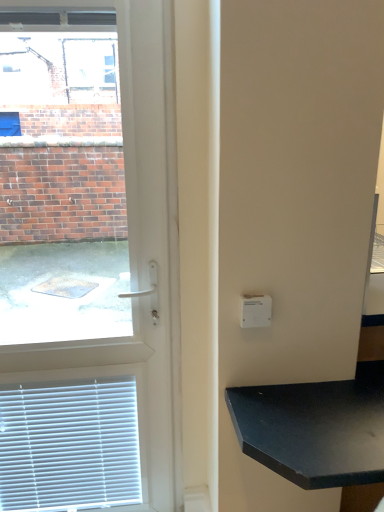
Question: From a real-world perspective, is white plastic door at left positioned under black matte table at lower right based on gravity?

Choices:
 (A) no
 (B) yes

Answer: (A)

Question: Is black matte table at lower right located within white plastic door at left?

Choices:
 (A) yes
 (B) no

Answer: (B)

Question: Does white plastic door at left have a greater width compared to black matte table at lower right?

Choices:
 (A) yes
 (B) no

Answer: (B)

Question: Does white plastic door at left appear on the right side of black matte table at lower right?

Choices:
 (A) no
 (B) yes

Answer: (A)

Question: Is white plastic door at left facing towards black matte table at lower right?

Choices:
 (A) no
 (B) yes

Answer: (A)

Question: From their relative heights in the image, would you say white plastic light switch at upper right is taller or shorter than white plastic door at left?

Choices:
 (A) short
 (B) tall

Answer: (A)

Question: From the image's perspective, is white plastic light switch at upper right above or below white plastic door at left?

Choices:
 (A) above
 (B) below

Answer: (A)

Question: From a real-world perspective, is white plastic light switch at upper right physically located above or below white plastic door at left?

Choices:
 (A) below
 (B) above

Answer: (B)

Question: Considering the positions of white plastic light switch at upper right and white plastic door at left in the image, is white plastic light switch at upper right bigger or smaller than white plastic door at left?

Choices:
 (A) big
 (B) small

Answer: (B)

Question: From a real-world perspective, is white plastic door at left positioned above or below black matte table at lower right?

Choices:
 (A) below
 (B) above

Answer: (B)

Question: In terms of height, does white plastic door at left look taller or shorter compared to black matte table at lower right?

Choices:
 (A) tall
 (B) short

Answer: (A)

Question: Considering the positions of white plastic door at left and black matte table at lower right in the image, is white plastic door at left wider or thinner than black matte table at lower right?

Choices:
 (A) wide
 (B) thin

Answer: (B)

Question: From the image's perspective, relative to black matte table at lower right, is white plastic door at left above or below?

Choices:
 (A) above
 (B) below

Answer: (A)

Question: In the image, is white plastic light switch at upper right on the left side or the right side of black matte table at lower right?

Choices:
 (A) left
 (B) right

Answer: (A)

Question: Considering the positions of point (246, 303) and point (258, 415), is point (246, 303) closer or farther from the camera than point (258, 415)?

Choices:
 (A) closer
 (B) farther

Answer: (B)